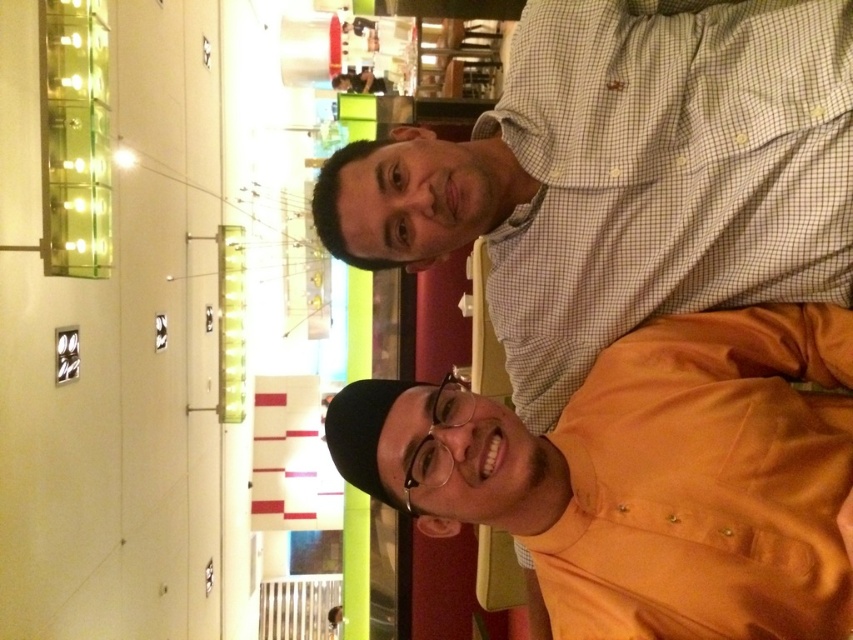
You are taking a photo of the two people in the scene. The orange satin shirt at upper right and the white checkered shirt at upper right are both in the frame. Which shirt is positioned lower in the image?

The orange satin shirt at upper right is located below the white checkered shirt at upper right, so it is positioned lower in the image.